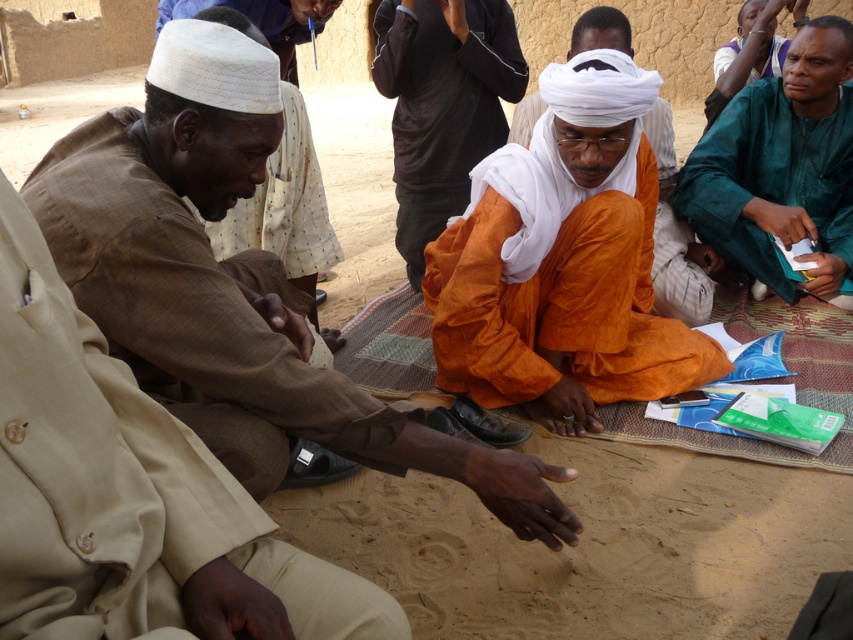
Which is in front, point (129, 600) or point (437, 180)?

Point (129, 600) is in front.

Can you confirm if beige cotton robe at left is thinner than orange cloth at center?

Yes.

Does point (22, 532) come in front of point (399, 38)?

Yes, point (22, 532) is closer to viewer.

This screenshot has width=853, height=640. Find the location of `beige cotton robe at left`. beige cotton robe at left is located at coordinates tap(126, 490).

Is brown textured cloth at center to the left of orange cotton turban at center from the viewer's perspective?

Indeed, brown textured cloth at center is positioned on the left side of orange cotton turban at center.

Is brown textured cloth at center shorter than orange cotton turban at center?

Yes, brown textured cloth at center is shorter than orange cotton turban at center.

Is point (183, 84) more distant than point (538, 99)?

That is False.

Find the location of a particular element. This screenshot has height=640, width=853. brown textured cloth at center is located at coordinates (231, 289).

Does point (496, 340) come in front of point (740, 141)?

Yes, it is.

This screenshot has width=853, height=640. In order to click on orange cotton robe at center in this screenshot , I will do `click(561, 260)`.

What do you see at coordinates (561, 260) in the screenshot? I see `orange cotton robe at center` at bounding box center [561, 260].

Image resolution: width=853 pixels, height=640 pixels. In order to click on orange cotton robe at center in this screenshot , I will do `click(561, 260)`.